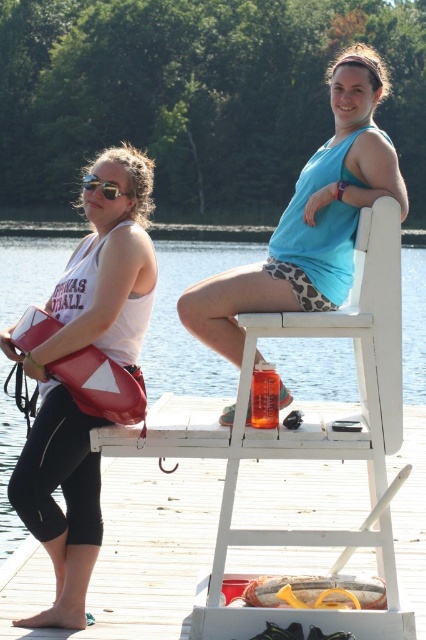
Can you confirm if white wood dock at center is smaller than matte white tank top at left?

Yes, white wood dock at center is smaller than matte white tank top at left.

Is point (120, 481) in front of point (43, 525)?

No, (120, 481) is further to viewer.

Is point (340, 516) farther from camera compared to point (143, 305)?

That is True.

Find the location of a particular element. This screenshot has height=640, width=426. white wood dock at center is located at coordinates (132, 554).

Is matte white tank top at left smaller than matte black sunglasses at left?

Correct, matte white tank top at left occupies less space than matte black sunglasses at left.

Who is lower down, matte white tank top at left or matte black sunglasses at left?

matte white tank top at left

Which is behind, point (52, 474) or point (92, 177)?

The point (92, 177) is more distant.

Locate an element on the screen. The width and height of the screenshot is (426, 640). matte white tank top at left is located at coordinates point(66,388).

What are the coordinates of `blue fabric tank top at center` in the screenshot? It's located at (310, 218).

Does blue fabric tank top at center have a greater height compared to matte black sunglasses at left?

Correct, blue fabric tank top at center is much taller as matte black sunglasses at left.

This screenshot has height=640, width=426. What do you see at coordinates (310, 218) in the screenshot?
I see `blue fabric tank top at center` at bounding box center [310, 218].

What are the coordinates of `blue fabric tank top at center` in the screenshot? It's located at (310, 218).